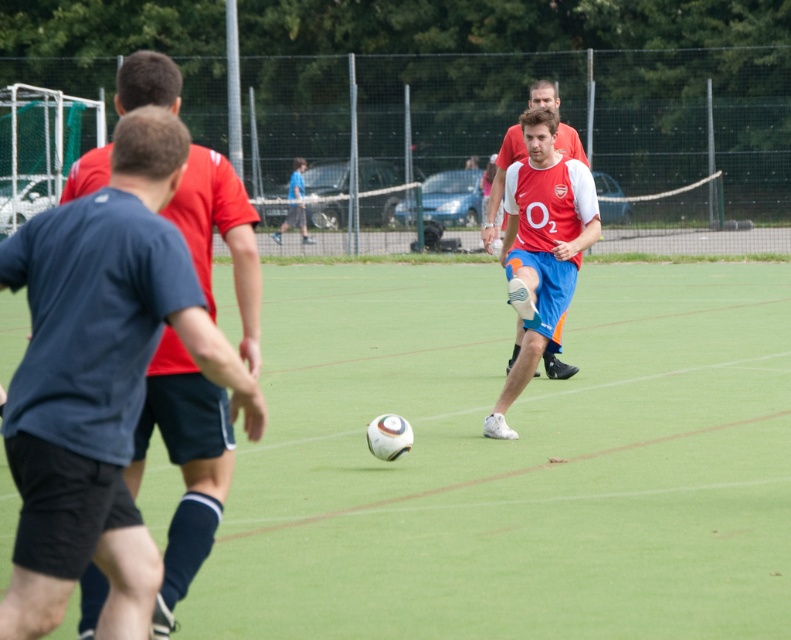
You are a photographer standing at the edge of the green grass football field at center and the blue cotton shirt at left. You want to capture a wide shot that includes both objects. Which object should you position closer to the center of the frame to ensure both are fully visible?

The blue cotton shirt at left should be positioned closer to the center of the frame since the green grass football field at center is wider than the blue cotton shirt at left, ensuring both fit within the shot.

You are a soccer player standing at the edge of the field near the fence. You see the point marked at coordinates (513, 461). What is located at that point?

The point at coordinates (513, 461) indicates the green grass football field at center.

You are a photographer standing at the edge of the soccer field. You want to take a photo that includes both the point at coordinates point (356, 360) and point (483, 236). Which point should you focus on first to ensure both are in focus?

You should focus on point (483, 236) first because it is closer to you than point (356, 360), which is further away. This way, the depth of field will cover both points effectively.